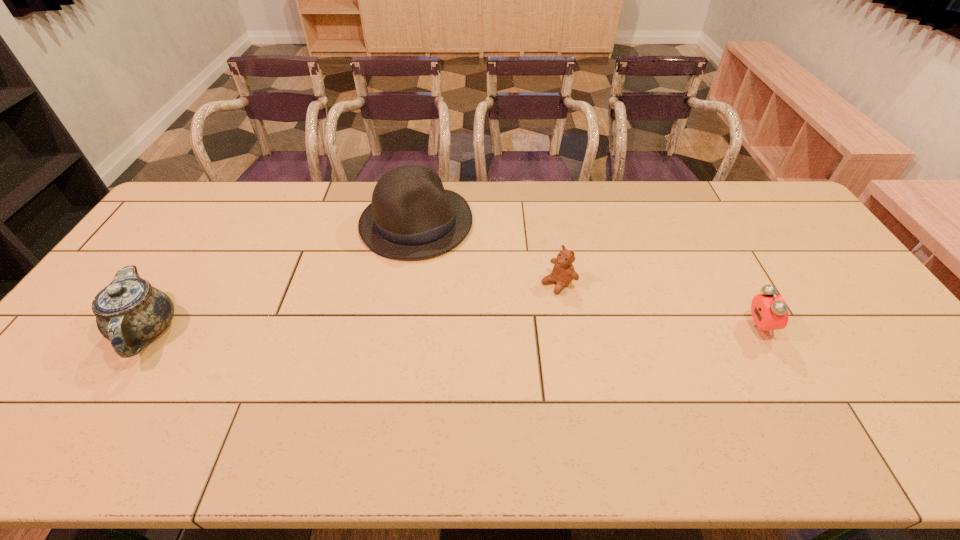
Where is `free space located 0.120m on the face of the third object from left to right`? free space located 0.120m on the face of the third object from left to right is located at coordinates (516, 312).

Identify the location of vacant position located 0.190m on the face of the third object from left to right. (497, 325).

This screenshot has height=540, width=960. In order to click on free space located 0.400m on the face of the third object from left to right in this screenshot , I will do `click(434, 368)`.

Find the location of `object that is at the far edge`. object that is at the far edge is located at coordinates (412, 216).

The height and width of the screenshot is (540, 960). What are the coordinates of `object that is at the left edge` in the screenshot? It's located at (129, 311).

The width and height of the screenshot is (960, 540). In the image, there is a desktop. What are the coordinates of `blank space at the far edge` in the screenshot? It's located at (265, 206).

The height and width of the screenshot is (540, 960). In the image, there is a desktop. What are the coordinates of `vacant region at the near edge` in the screenshot? It's located at (571, 397).

Find the location of `blank space at the left edge of the desktop`. blank space at the left edge of the desktop is located at coordinates (155, 246).

The width and height of the screenshot is (960, 540). What are the coordinates of `vacant region at the far right corner of the desktop` in the screenshot? It's located at (736, 198).

Where is `vacant space in between the leftmost object and the teddy bear`? This screenshot has height=540, width=960. vacant space in between the leftmost object and the teddy bear is located at coordinates (352, 306).